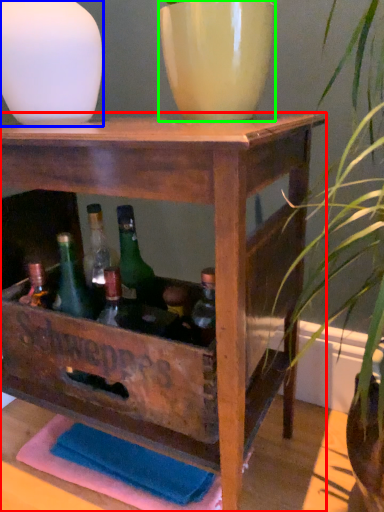
Question: Estimate the real-world distances between objects in this image. Which object is closer to table (highlighted by a red box), vase (highlighted by a blue box) or flowerpot (highlighted by a green box)?

Choices:
 (A) vase
 (B) flowerpot

Answer: (B)